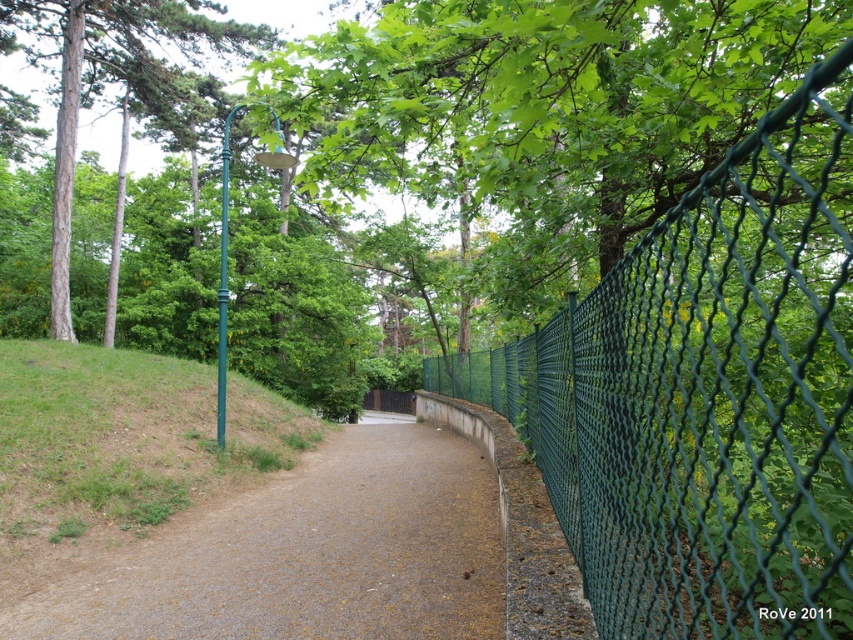
Question: Which object is the closest to the brown gravel trail at center?

Choices:
 (A) green metallic pole at upper center
 (B) green mesh fence at right

Answer: (B)

Question: Is green mesh fence at right thinner than brown gravel trail at center?

Choices:
 (A) no
 (B) yes

Answer: (A)

Question: From the image, what is the correct spatial relationship of green mesh fence at right in relation to brown gravel trail at center?

Choices:
 (A) above
 (B) below

Answer: (A)

Question: Which object appears farthest from the camera in this image?

Choices:
 (A) green metallic pole at upper center
 (B) green mesh fence at right
 (C) brown gravel trail at center

Answer: (A)

Question: Can you confirm if green mesh fence at right is positioned to the right of brown gravel trail at center?

Choices:
 (A) no
 (B) yes

Answer: (B)

Question: Which point appears closest to the camera in this image?

Choices:
 (A) (154, 4)
 (B) (592, 376)

Answer: (B)